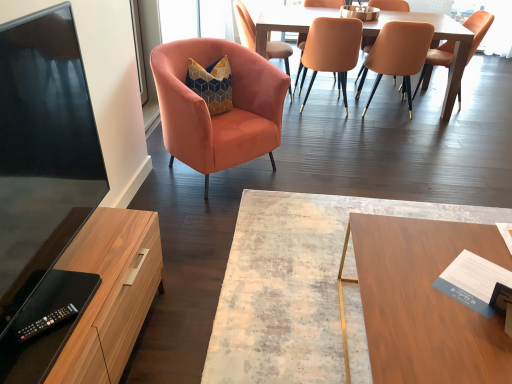
Where is `free space between matte orange chair at upper right, positioned as the 1th chair in right-to-left order, and wooden rectangular table at center`? The width and height of the screenshot is (512, 384). free space between matte orange chair at upper right, positioned as the 1th chair in right-to-left order, and wooden rectangular table at center is located at coordinates (402, 155).